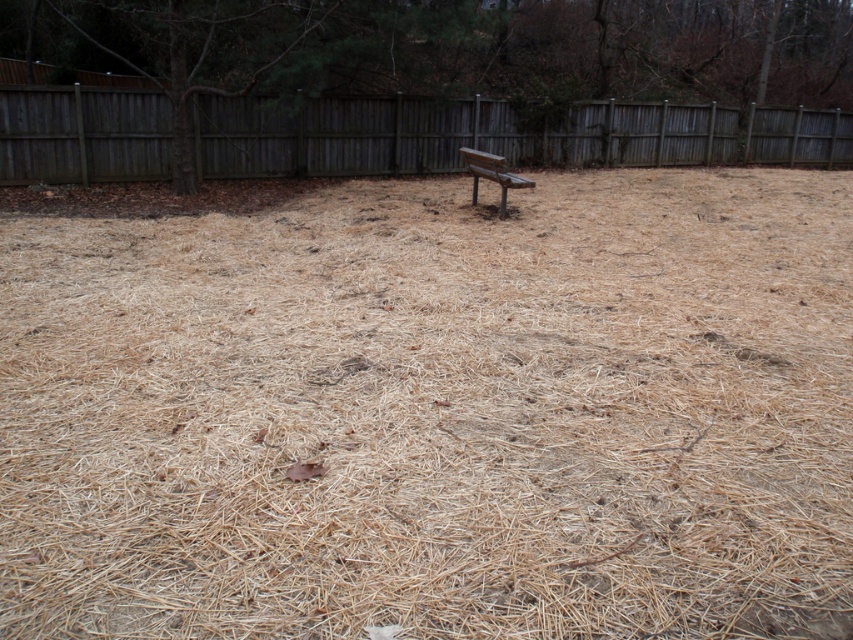
You are standing in the backyard and want to place a small potted plant between the brown straw at center and the weathered wood fence at upper center. Based on their positions, where should you place the plant?

The brown straw at center is below the weathered wood fence at upper center, so you should place the potted plant between them by positioning it near the middle area where the straw is located, but closer to the fence to ensure it is between both objects.

You are standing in the backyard and want to place a small potted plant exactly at the center of the brown straw at center. Where should you place the potted plant?

The brown straw at center is located at the 2D coordinates point (433, 410), so you should place the potted plant at that exact point.

You are planning to place a small doghouse in this backyard. The doghouse requires a clear space of 1 meter by 1 meter. Based on the scene, can you determine if there is enough space between the brown straw at center and the wooden bench at center to accommodate the doghouse?

The brown straw at center is bigger than wooden bench at center, so the area around the brown straw at center may have sufficient space for the doghouse. However, since the straw is described as covering the foreground unevenly, you should check the specific area for dense packing before deciding.